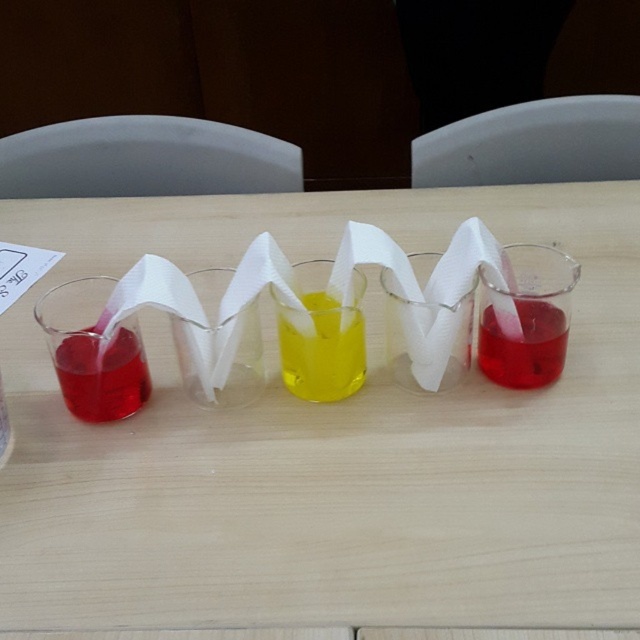
Between transparent glass beakers at center and yellow translucent liquid at center, which one is positioned lower?

Positioned lower is yellow translucent liquid at center.

Which is behind, point (378, 285) or point (298, 384)?

Positioned behind is point (378, 285).

Which is in front, point (259, 465) or point (285, 371)?

Positioned in front is point (259, 465).

At what (x,y) coordinates should I click in order to perform the action: click on transparent glass beakers at center. Please return your answer as a coordinate pair (x, y). The height and width of the screenshot is (640, 640). Looking at the image, I should click on (330, 442).

Can you confirm if transparent glass beakers at center is positioned to the left of matte plastic beaker at right?

Correct, you'll find transparent glass beakers at center to the left of matte plastic beaker at right.

Based on the photo, does transparent glass beakers at center have a greater width compared to matte plastic beaker at right?

Yes.

Who is more distant from viewer, (540, 492) or (540, 316)?

Point (540, 316)

Locate an element on the screen. This screenshot has width=640, height=640. transparent glass beakers at center is located at coordinates (330, 442).

How distant is yellow translucent liquid at center from matte plastic beaker at right?

They are 6.58 inches apart.

Which is in front, point (340, 392) or point (486, 362)?

Point (340, 392)

Find the location of a particular element. Image resolution: width=640 pixels, height=640 pixels. yellow translucent liquid at center is located at coordinates (323, 349).